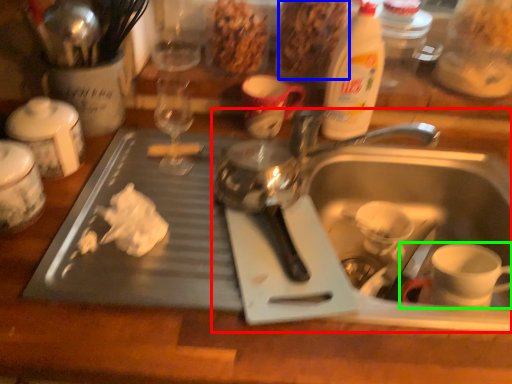
Question: Which object is the farthest from sink (highlighted by a red box)? Choose among these: food (highlighted by a blue box) or coffee cup (highlighted by a green box).

Choices:
 (A) food
 (B) coffee cup

Answer: (A)